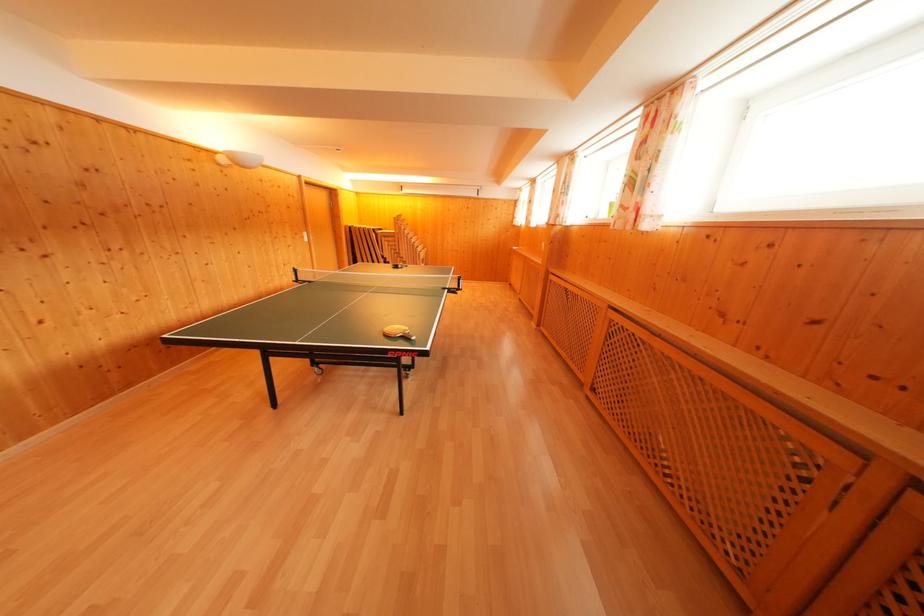
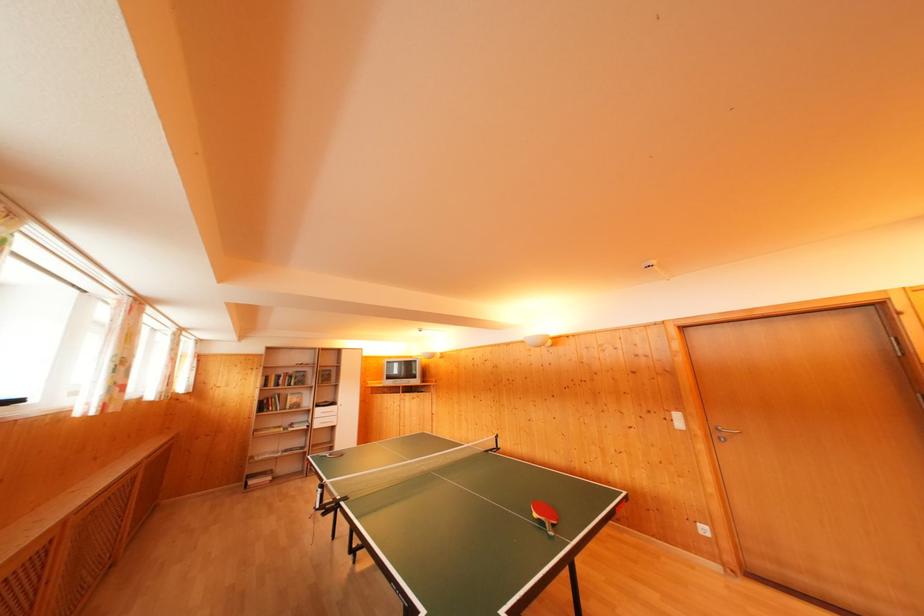
Find the pixel in the second image that matches the point at 310,240 in the first image.

(682, 421)